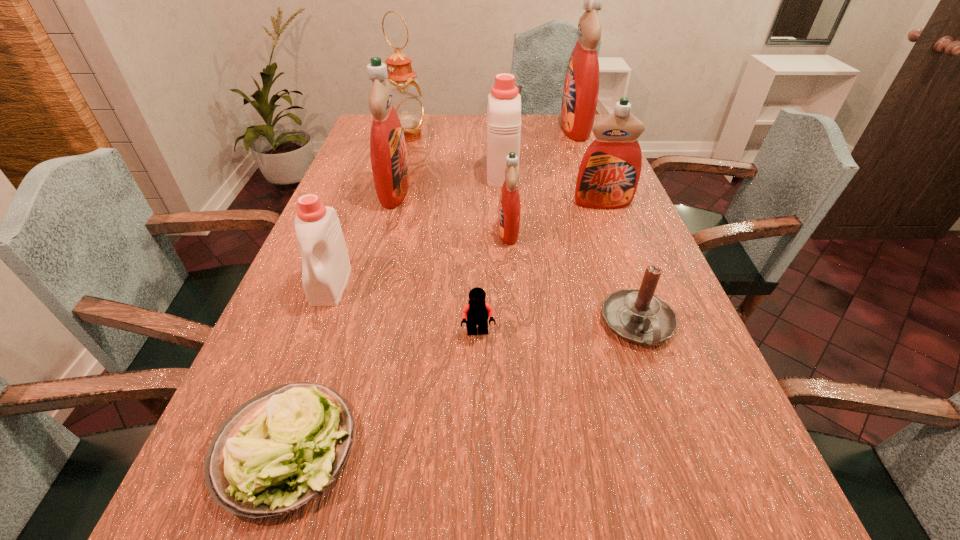
The width and height of the screenshot is (960, 540). What are the coordinates of `vacant space that satisfies the following two spatial constraints: 1. on the front surface of the sixth farthest object; 2. on the handle side of the nearer white detergent` in the screenshot? It's located at (513, 285).